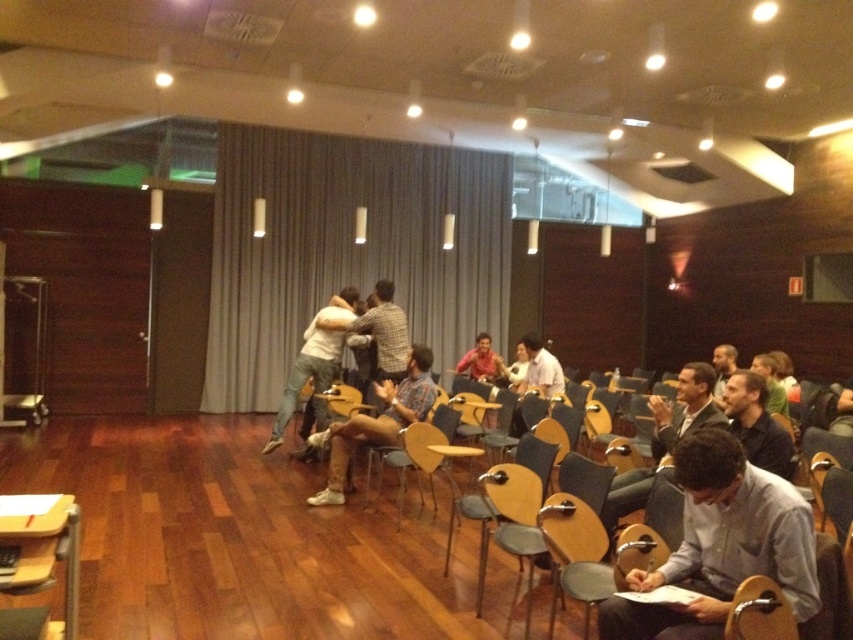
You are standing in the room and see a point at coordinates [315,356]. According to the scene description, what object or clothing item is located at that point?

The point at coordinates [315,356] is located on light gray jeans at center.

You are a person standing at the entrance of the room. You want to move to the light brown wood chair at lower right without stepping on the khaki cotton pants at center. Is this possible?

The khaki cotton pants at center is further to the viewer than the light brown wood chair at lower right, so the chair is behind the pants. Therefore, you can move around the khaki cotton pants at center to reach the chair without stepping on them.